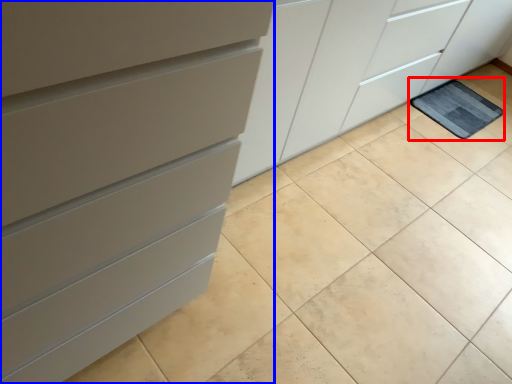
Question: Which object is closer to the camera taking this photo, bath mat (highlighted by a red box) or chest of drawers (highlighted by a blue box)?

Choices:
 (A) bath mat
 (B) chest of drawers

Answer: (B)